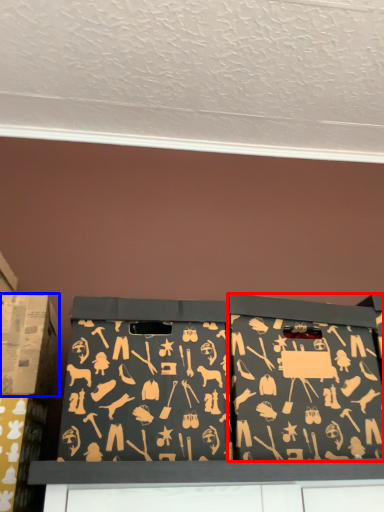
Question: Which object appears farthest to the camera in this image, box (highlighted by a red box) or box (highlighted by a blue box)?

Choices:
 (A) box
 (B) box

Answer: (B)